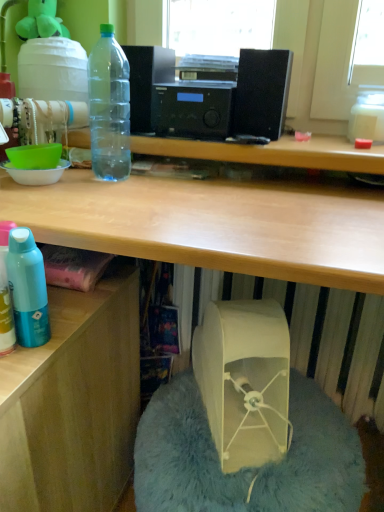
What do you see at coordinates (73, 402) in the screenshot? The height and width of the screenshot is (512, 384). I see `wooden desk at lower left` at bounding box center [73, 402].

The image size is (384, 512). Find the location of `transparent plastic water cooler at upper left`. transparent plastic water cooler at upper left is located at coordinates point(55,74).

The width and height of the screenshot is (384, 512). I want to click on beige fabric bag at lower center, so click(x=245, y=380).

Describe the element at coordinates (249, 467) in the screenshot. The width and height of the screenshot is (384, 512). I see `beige fabric bean bag chair at lower center` at that location.

This screenshot has width=384, height=512. Describe the element at coordinates (109, 106) in the screenshot. I see `transparent plastic bottle at upper left` at that location.

The height and width of the screenshot is (512, 384). What are the coordinates of `wooden desk at lower left` in the screenshot? It's located at coord(73,402).

Find the location of a particular element. The width and height of the screenshot is (384, 512). bean bag chair below the transparent plastic water cooler at upper left (from a real-world perspective) is located at coordinates 249,467.

From a real-world perspective, which object rests below the other?

beige fabric bean bag chair at lower center, from a real-world perspective.

Is beige fabric bean bag chair at lower center directly adjacent to transparent plastic water cooler at upper left?

beige fabric bean bag chair at lower center is not next to transparent plastic water cooler at upper left, and they're not touching.

From a real-world perspective, is transparent plastic bottle at upper left physically located above or below transparent plastic water cooler at upper left?

Clearly, from a real-world perspective, transparent plastic bottle at upper left is below transparent plastic water cooler at upper left.

Which of these two, transparent plastic bottle at upper left or transparent plastic water cooler at upper left, is smaller?

Smaller between the two is transparent plastic bottle at upper left.

Relative to transparent plastic water cooler at upper left, is transparent plastic bottle at upper left in front or behind?

In the image, transparent plastic bottle at upper left appears in front of transparent plastic water cooler at upper left.

Is point (118, 145) farther from camera compared to point (46, 55)?

Yes, it is behind point (46, 55).

Can you tell me how much beige fabric bag at lower center and transparent plastic bottle at upper left differ in facing direction?

24.2 degrees.

Is beige fabric bag at lower center directly adjacent to transparent plastic bottle at upper left?

No, beige fabric bag at lower center is not with transparent plastic bottle at upper left.

Where is `bottle above the beige fabric bag at lower center (from the image's perspective)`? bottle above the beige fabric bag at lower center (from the image's perspective) is located at coordinates (109, 106).

Is beige fabric bag at lower center facing towards transparent plastic bottle at upper left?

No, beige fabric bag at lower center does not turn towards transparent plastic bottle at upper left.

Find the location of a particular element. This screenshot has width=384, height=512. bottle located above the beige fabric bean bag chair at lower center (from a real-world perspective) is located at coordinates (109, 106).

Is point (275, 502) closer or farther from the camera than point (94, 167)?

Clearly, point (275, 502) is closer to the camera than point (94, 167).

Is beige fabric bean bag chair at lower center facing away from transparent plastic bottle at upper left?

No, beige fabric bean bag chair at lower center's orientation is not away from transparent plastic bottle at upper left.

Is beige fabric bean bag chair at lower center bigger or smaller than transparent plastic bottle at upper left?

In the image, beige fabric bean bag chair at lower center appears to be larger than transparent plastic bottle at upper left.

Considering the points (271, 316) and (283, 474), which point is behind, point (271, 316) or point (283, 474)?

The point (271, 316) is farther from the camera.

Looking at this image, considering the relative sizes of beige fabric bag at lower center and beige fabric bean bag chair at lower center in the image provided, is beige fabric bag at lower center wider than beige fabric bean bag chair at lower center?

No, beige fabric bag at lower center is not wider than beige fabric bean bag chair at lower center.

In the image, is beige fabric bag at lower center positioned in front of or behind beige fabric bean bag chair at lower center?

beige fabric bag at lower center is behind beige fabric bean bag chair at lower center.

From a real-world perspective, is beige fabric bag at lower center below beige fabric bean bag chair at lower center?

No, from a real-world perspective, beige fabric bag at lower center is not under beige fabric bean bag chair at lower center.

Is transparent plastic water cooler at upper left not inside transparent plastic bottle at upper left?

Yes, transparent plastic water cooler at upper left is not within transparent plastic bottle at upper left.

Does transparent plastic water cooler at upper left have a greater width compared to transparent plastic bottle at upper left?

Correct, the width of transparent plastic water cooler at upper left exceeds that of transparent plastic bottle at upper left.

Where is `water cooler behind the transparent plastic bottle at upper left`? Image resolution: width=384 pixels, height=512 pixels. water cooler behind the transparent plastic bottle at upper left is located at coordinates (55, 74).

In order to click on bean bag chair that appears below the transparent plastic water cooler at upper left (from a real-world perspective) in this screenshot , I will do `click(249, 467)`.

Consider the image. Considering the sizes of objects transparent plastic water cooler at upper left and beige fabric bean bag chair at lower center in the image provided, who is shorter, transparent plastic water cooler at upper left or beige fabric bean bag chair at lower center?

transparent plastic water cooler at upper left is shorter.

From a real-world perspective, is transparent plastic water cooler at upper left on top of beige fabric bean bag chair at lower center?

Yes, from a real-world perspective, transparent plastic water cooler at upper left is over beige fabric bean bag chair at lower center

In the scene shown: Which is closer to the camera, (77, 123) or (295, 450)?

Point (295, 450)

This screenshot has height=512, width=384. There is a beige fabric bean bag chair at lower center. What are the coordinates of `water cooler above it (from a real-world perspective)` in the screenshot? It's located at (55, 74).

The width and height of the screenshot is (384, 512). What are the coordinates of `water cooler behind the transparent plastic bottle at upper left` in the screenshot? It's located at (55, 74).

From the image, which object appears to be nearer to wooden desk at lower left, beige fabric bean bag chair at lower center or transparent plastic bottle at upper left?

Based on the image, beige fabric bean bag chair at lower center appears to be nearer to wooden desk at lower left.

Based on their spatial positions, is wooden desk at lower left or transparent plastic water cooler at upper left further from beige fabric bean bag chair at lower center?

transparent plastic water cooler at upper left lies further to beige fabric bean bag chair at lower center than the other object.

Consider the image. Estimate the real-world distances between objects in this image. Which object is further from transparent plastic water cooler at upper left, beige fabric bean bag chair at lower center or wooden desk at lower left?

beige fabric bean bag chair at lower center.

Considering their positions, is transparent plastic bottle at upper left positioned further to transparent plastic water cooler at upper left than wooden desk at lower left?

wooden desk at lower left lies further to transparent plastic water cooler at upper left than the other object.

Looking at the image, which one is located closer to transparent plastic water cooler at upper left, beige fabric bag at lower center or transparent plastic bottle at upper left?

Among the two, transparent plastic bottle at upper left is located nearer to transparent plastic water cooler at upper left.

In the scene shown: From the image, which object appears to be farther from transparent plastic water cooler at upper left, wooden desk at lower left or beige fabric bag at lower center?

beige fabric bag at lower center lies further to transparent plastic water cooler at upper left than the other object.

Considering their positions, is wooden desk at lower left positioned further to beige fabric bag at lower center than beige fabric bean bag chair at lower center?

The object further to beige fabric bag at lower center is wooden desk at lower left.

Consider the image. Estimate the real-world distances between objects in this image. Which object is closer to beige fabric bag at lower center, beige fabric bean bag chair at lower center or transparent plastic water cooler at upper left?

beige fabric bean bag chair at lower center.

The image size is (384, 512). I want to click on desk between transparent plastic bottle at upper left and beige fabric bean bag chair at lower center in the vertical direction, so click(x=73, y=402).

Find the location of a particular element. bottle between transparent plastic water cooler at upper left and wooden desk at lower left from top to bottom is located at coordinates (109, 106).

Image resolution: width=384 pixels, height=512 pixels. I want to click on wide that lies between transparent plastic bottle at upper left and beige fabric bean bag chair at lower center from top to bottom, so click(245, 380).

You are a GUI agent. You are given a task and a screenshot of the screen. Output one action in this format:
    pyautogui.click(x=<x>, y=<y>)
    Task: Click on the wide that lies between transparent plastic bottle at upper left and wooden desk at lower left from top to bottom
    The width and height of the screenshot is (384, 512).
    Given the screenshot: What is the action you would take?
    pyautogui.click(x=245, y=380)